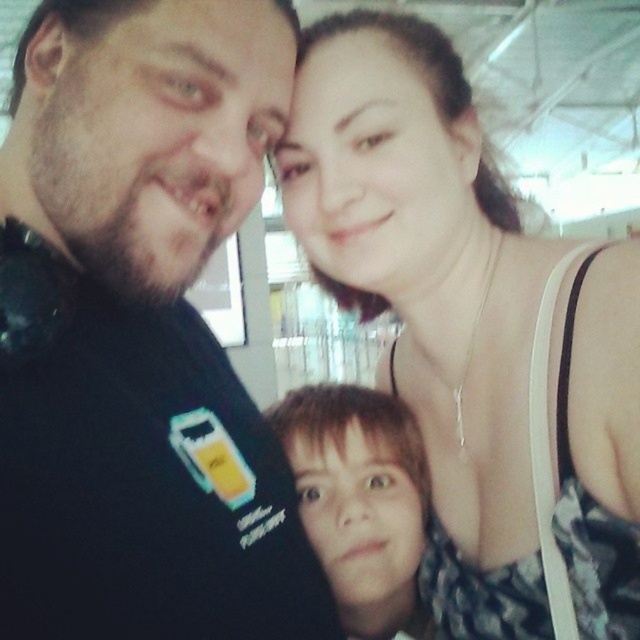
Can you confirm if matte black tank top at upper right is positioned above smooth skin face at center?

Yes, matte black tank top at upper right is above smooth skin face at center.

Looking at this image, who is higher up, matte black tank top at upper right or smooth skin face at center?

matte black tank top at upper right is higher up.

Where is `matte black tank top at upper right`? matte black tank top at upper right is located at coordinates pyautogui.click(x=474, y=330).

Between black matte shirt at upper left and matte black tank top at upper right, which one has more height?

matte black tank top at upper right

Is point (212, 188) farther from camera compared to point (314, 176)?

No, it is not.

Is point (58, 33) more distant than point (307, 232)?

No, it is in front of (307, 232).

This screenshot has width=640, height=640. What are the coordinates of `black matte shirt at upper left` in the screenshot? It's located at (140, 332).

Does black matte shirt at upper left have a greater height compared to smooth skin face at center?

Yes.

Consider the image. Is black matte shirt at upper left above smooth skin face at center?

Correct, black matte shirt at upper left is located above smooth skin face at center.

Locate an element on the screen. The image size is (640, 640). black matte shirt at upper left is located at coordinates (140, 332).

Where is `black matte shirt at upper left`? black matte shirt at upper left is located at coordinates (140, 332).